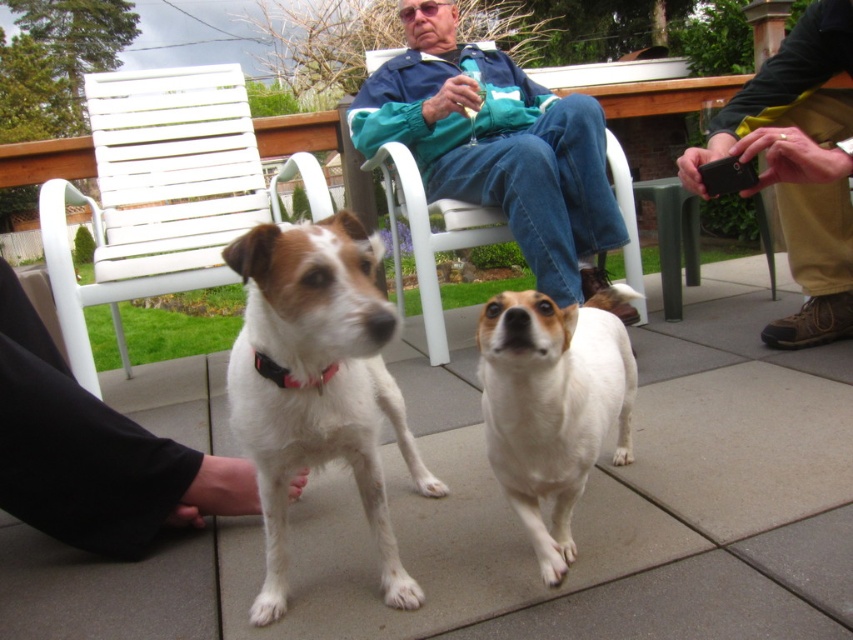
Question: Which point is farther to the camera?

Choices:
 (A) (618, 316)
 (B) (738, 132)

Answer: (A)

Question: Which point is farther from the camera taking this photo?

Choices:
 (A) tap(544, 205)
 (B) tap(322, 384)
 (C) tap(795, 90)
 (D) tap(264, 488)

Answer: (A)

Question: Which object is closer to the camera taking this photo?

Choices:
 (A) black fabric neckband at center
 (B) white fur dog at center

Answer: (B)

Question: Is white matte dog at center thinner than blue denim jacket at upper center?

Choices:
 (A) yes
 (B) no

Answer: (A)

Question: Can you confirm if black leather wallet at right is positioned to the right of black fabric neckband at center?

Choices:
 (A) no
 (B) yes

Answer: (B)

Question: Can you confirm if white fabric pants at lower left is wider than white fur dog at center?

Choices:
 (A) no
 (B) yes

Answer: (B)